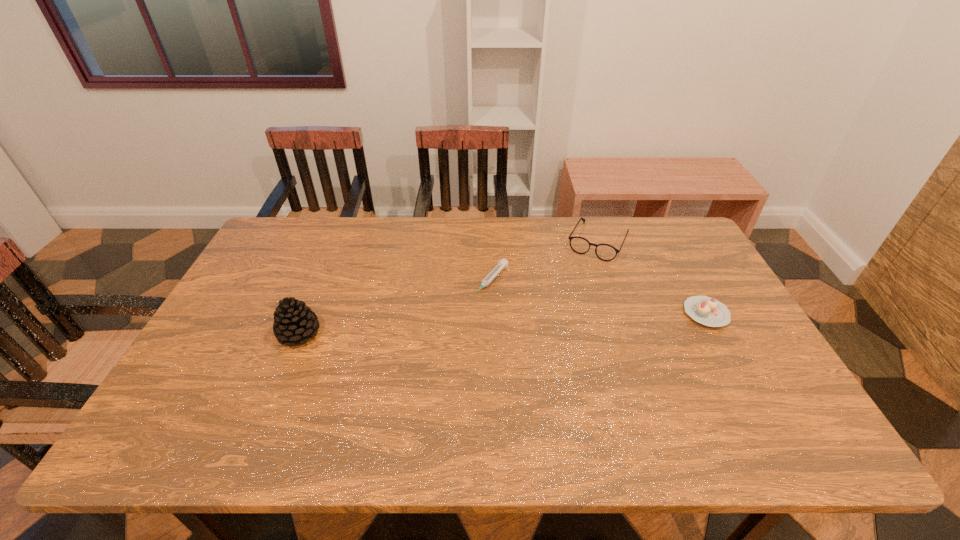
Locate an element on the screen. This screenshot has height=540, width=960. free space located 0.330m at the needle end of the second object from left to right is located at coordinates (411, 374).

This screenshot has width=960, height=540. In order to click on vacant region located at the needle end of the second object from left to right in this screenshot , I will do `click(467, 313)`.

You are a GUI agent. You are given a task and a screenshot of the screen. Output one action in this format:
    pyautogui.click(x=<x>, y=<y>)
    Task: Click on the vacant space located 0.080m at the needle end of the second object from left to right
    The height and width of the screenshot is (540, 960).
    Given the screenshot: What is the action you would take?
    pyautogui.click(x=467, y=313)

In order to click on free region located on the front-facing side of the third shortest object in this screenshot , I will do `click(552, 334)`.

I want to click on vacant space located on the front-facing side of the third shortest object, so click(x=578, y=284).

Locate an element on the screen. The height and width of the screenshot is (540, 960). vacant region located 0.270m on the front-facing side of the third shortest object is located at coordinates (562, 315).

At what (x,y) coordinates should I click in order to perform the action: click on object present at the far edge. Please return your answer as a coordinate pair (x, y). Looking at the image, I should click on (605, 252).

Find the location of `object located in the right edge section of the desktop`. object located in the right edge section of the desktop is located at coordinates (708, 311).

At what (x,y) coordinates should I click in order to perform the action: click on free space at the far edge. Please return your answer as a coordinate pair (x, y). Looking at the image, I should click on (398, 240).

In the image, there is a desktop. What are the coordinates of `free space at the near edge` in the screenshot? It's located at (698, 396).